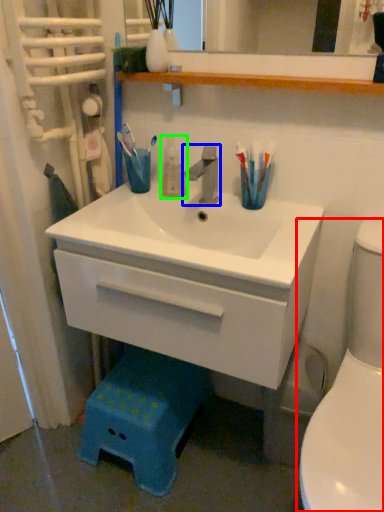
Question: Which is nearer to the toilet (highlighted by a red box)? tap (highlighted by a blue box) or mouthwash (highlighted by a green box).

Choices:
 (A) tap
 (B) mouthwash

Answer: (A)